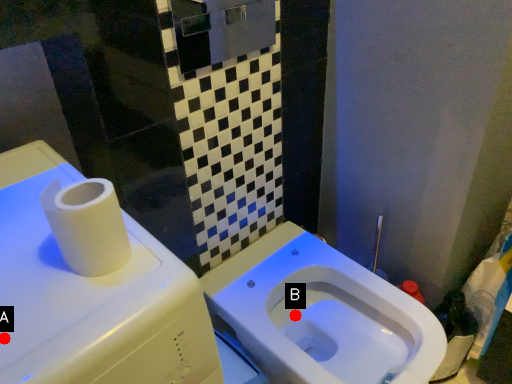
Question: Two points are circled on the image, labeled by A and B beside each circle. Which of the following is the closest to the observer?

Choices:
 (A) A is closer
 (B) B is closer

Answer: (A)